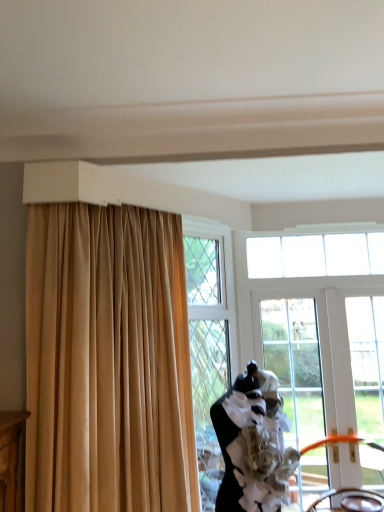
Question: Considering the relative positions of clear glass door at center and clear glass window at upper center, which appears as the second window when ordered from the bottom, in the image provided, is clear glass door at center in front of clear glass window at upper center, which appears as the second window when ordered from the bottom,?

Choices:
 (A) no
 (B) yes

Answer: (B)

Question: Is clear glass door at center touching clear glass window at upper center, arranged as the 1th window when viewed from the top?

Choices:
 (A) no
 (B) yes

Answer: (A)

Question: From the image's perspective, is clear glass door at center beneath clear glass window at upper center, which appears as the second window when ordered from the bottom?

Choices:
 (A) no
 (B) yes

Answer: (B)

Question: Considering the relative sizes of clear glass door at center and clear glass window at upper center, which appears as the second window when ordered from the bottom, in the image provided, is clear glass door at center taller than clear glass window at upper center, which appears as the second window when ordered from the bottom,?

Choices:
 (A) no
 (B) yes

Answer: (B)

Question: Can clear glass window at upper center, which appears as the second window when ordered from the bottom, be found inside clear glass door at center?

Choices:
 (A) no
 (B) yes

Answer: (A)

Question: From the image's perspective, is clear glass door at center over clear glass window at upper center, which appears as the second window when ordered from the bottom?

Choices:
 (A) no
 (B) yes

Answer: (A)

Question: Is black matte dress form at center positioned behind clear glass window at upper center, which appears as the second window when ordered from the bottom?

Choices:
 (A) yes
 (B) no

Answer: (B)

Question: Is black matte dress form at center thinner than clear glass window at upper center, arranged as the 1th window when viewed from the top?

Choices:
 (A) no
 (B) yes

Answer: (A)

Question: Could you tell me if black matte dress form at center is facing clear glass window at upper center, arranged as the 1th window when viewed from the top?

Choices:
 (A) yes
 (B) no

Answer: (B)

Question: Is black matte dress form at center placed right next to clear glass window at upper center, arranged as the 1th window when viewed from the top?

Choices:
 (A) yes
 (B) no

Answer: (B)

Question: Considering the relative sizes of black matte dress form at center and clear glass window at upper center, arranged as the 1th window when viewed from the top, in the image provided, is black matte dress form at center smaller than clear glass window at upper center, arranged as the 1th window when viewed from the top,?

Choices:
 (A) yes
 (B) no

Answer: (B)

Question: From the image's perspective, is black matte dress form at center located above clear glass window at upper center, which appears as the second window when ordered from the bottom?

Choices:
 (A) no
 (B) yes

Answer: (A)

Question: Does beige fabric curtain at upper left have a larger size compared to clear glass window at upper center, which appears as the second window when ordered from the bottom?

Choices:
 (A) yes
 (B) no

Answer: (A)